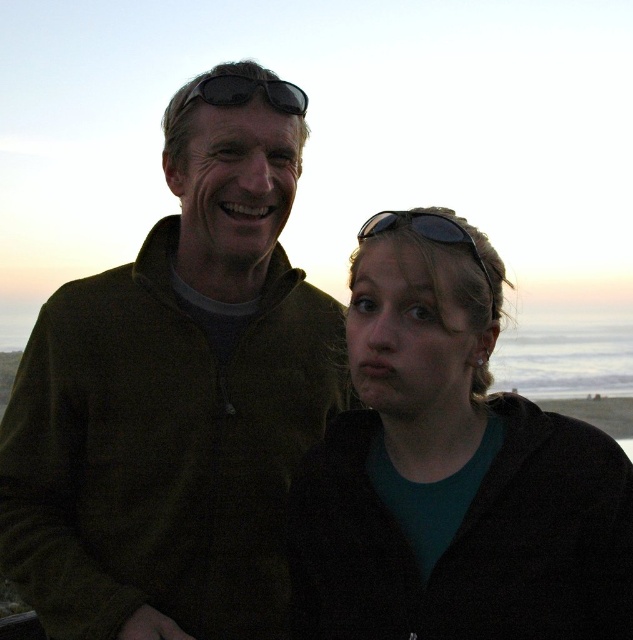
You are a GUI agent. You are given a task and a screenshot of the screen. Output one action in this format:
    pyautogui.click(x=<x>, y=<y>)
    Task: Click on the matte black jacket at center
    The image size is (633, 640).
    Given the screenshot: What is the action you would take?
    pyautogui.click(x=451, y=468)

Can you confirm if matte black jacket at center is positioned to the left of black plastic sunglasses at upper center?

Incorrect, matte black jacket at center is not on the left side of black plastic sunglasses at upper center.

The width and height of the screenshot is (633, 640). Describe the element at coordinates (451, 468) in the screenshot. I see `matte black jacket at center` at that location.

You are a GUI agent. You are given a task and a screenshot of the screen. Output one action in this format:
    pyautogui.click(x=<x>, y=<y>)
    Task: Click on the matte black jacket at center
    The height and width of the screenshot is (640, 633).
    Given the screenshot: What is the action you would take?
    pyautogui.click(x=451, y=468)

Who is lower down, dark green fleece at left or black matte sunglasses at upper center?

dark green fleece at left is lower down.

Is dark green fleece at left thinner than black matte sunglasses at upper center?

In fact, dark green fleece at left might be wider than black matte sunglasses at upper center.

Does point (216, 561) come closer to viewer compared to point (253, 80)?

Yes, point (216, 561) is closer to viewer.

Where is `dark green fleece at left`? This screenshot has height=640, width=633. dark green fleece at left is located at coordinates (173, 404).

Who is higher up, dark green fleece at left or black plastic sunglasses at upper center?

black plastic sunglasses at upper center

Does dark green fleece at left have a greater width compared to black plastic sunglasses at upper center?

Yes, dark green fleece at left is wider than black plastic sunglasses at upper center.

Describe the element at coordinates (173, 404) in the screenshot. I see `dark green fleece at left` at that location.

The height and width of the screenshot is (640, 633). What are the coordinates of `dark green fleece at left` in the screenshot? It's located at (173, 404).